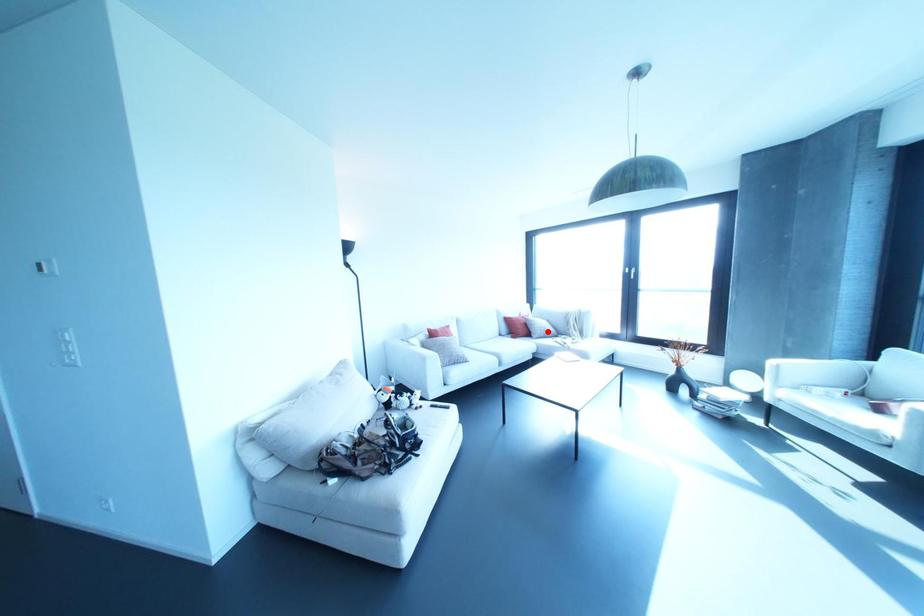
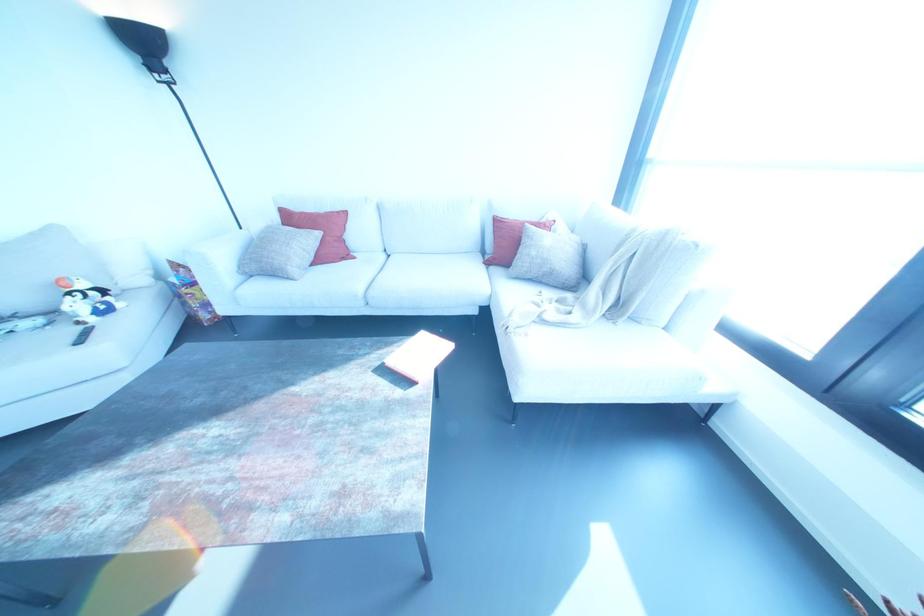
Question: A red point is marked in image1. In image2, is the corresponding 3D point closer to the camera or farther? Reply with the corresponding letter.

Choices:
 (A) The corresponding 3D point is closer.
 (B) The corresponding 3D point is farther.

Answer: (A)